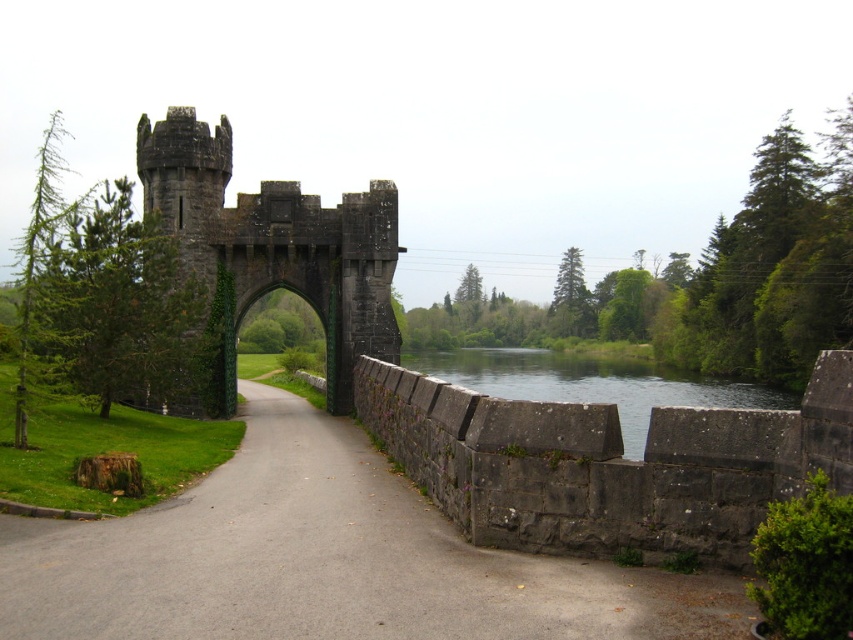
Question: Is gray asphalt path at center below dark gray stone castle at center?

Choices:
 (A) yes
 (B) no

Answer: (A)

Question: Which object is closer to the camera taking this photo?

Choices:
 (A) clear water at bridge right
 (B) dark gray stone castle at center
 (C) gray asphalt path at center

Answer: (C)

Question: Is gray asphalt path at center to the right of clear water at bridge right from the viewer's perspective?

Choices:
 (A) yes
 (B) no

Answer: (B)

Question: Which point appears farthest from the camera in this image?

Choices:
 (A) (286, 230)
 (B) (761, 390)

Answer: (B)

Question: Among these objects, which one is farthest from the camera?

Choices:
 (A) clear water at bridge right
 (B) dark gray stone castle at center

Answer: (B)

Question: Can you confirm if gray asphalt path at center is thinner than clear water at bridge right?

Choices:
 (A) no
 (B) yes

Answer: (B)